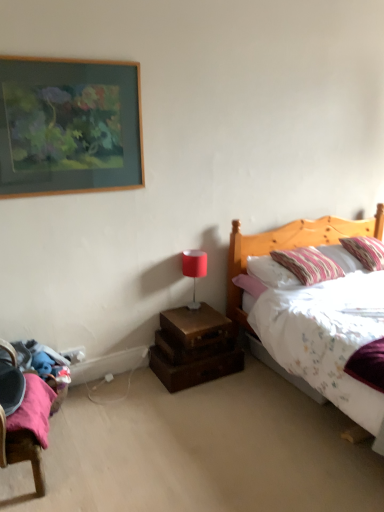
Find the location of a particular element. This screenshot has width=384, height=512. vacant space to the left of matte red lamp at center is located at coordinates (170, 313).